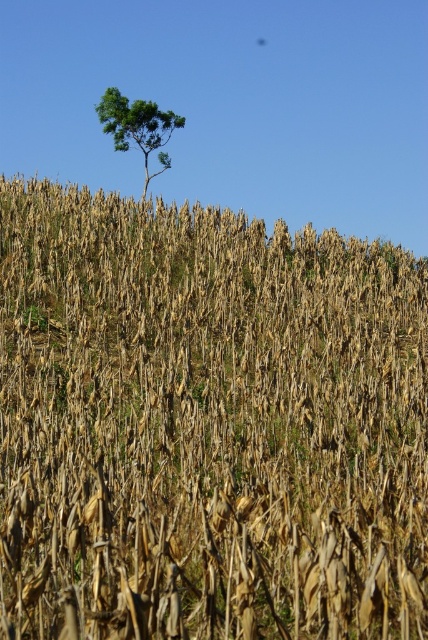
You are a farmer who wants to plant a new tree in the field. The existing green leafy tree at upper center is already present. You have a new sapling that needs 40 feet of space between it and any other trees to grow properly. Can you plant the new sapling near the brown dry stalks of corn at center without violating the spacing requirement?

The brown dry stalks of corn at center and the green leafy tree at upper center are 38.89 feet apart from each other. Since the required spacing is 40 feet, planting the new sapling near the brown dry stalks of corn at center would not meet the requirement as the distance is less than 40 feet.

You are a photographer standing in the field of corn stalks. You want to take a photo that includes both the brown dry stalks of corn at center and the green leafy tree at upper center. Which object will appear larger in the photo?

The brown dry stalks of corn at center will appear larger in the photo because they are closer to the viewer than the green leafy tree at upper center.